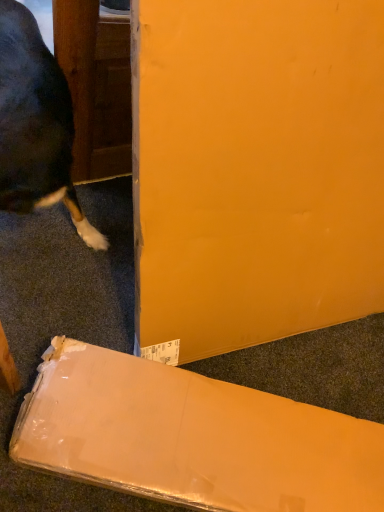
Question: Should I look upward or downward to see matte cardboard box at lower center?

Choices:
 (A) down
 (B) up

Answer: (A)